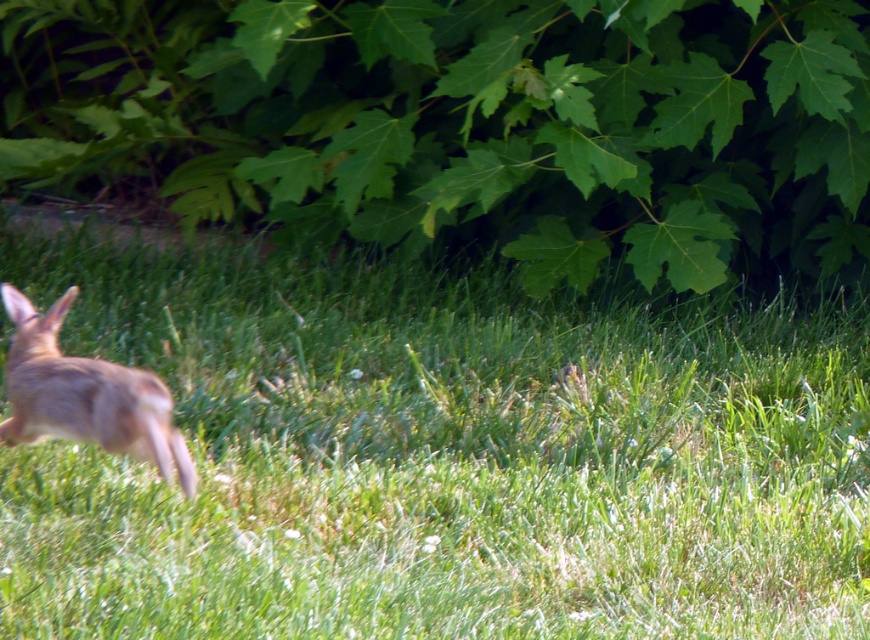
I want to click on green grassy at center, so click(439, 461).

The width and height of the screenshot is (870, 640). Describe the element at coordinates (439, 461) in the screenshot. I see `green grassy at center` at that location.

I want to click on green grassy at center, so [x=439, y=461].